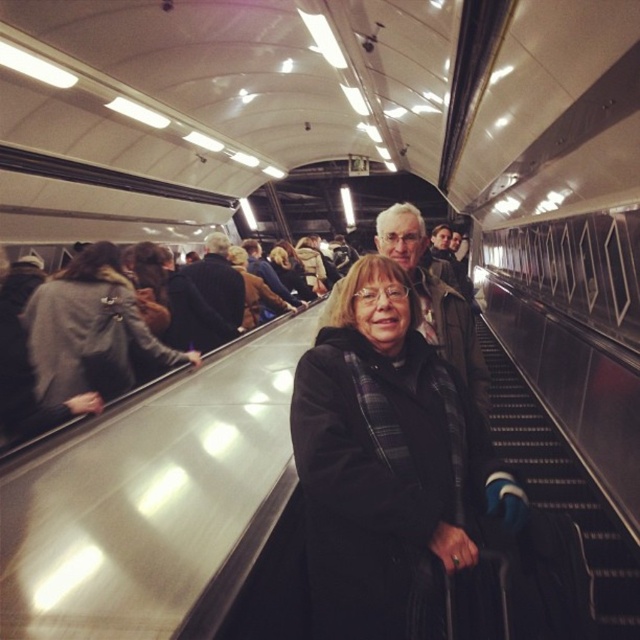
You are standing at the entrance of the subway station and see the image. There is a point marked at coordinates (392, 470). Which object in the scene does this point correspond to?

The point at coordinates (392, 470) corresponds to the black wool coat at center.